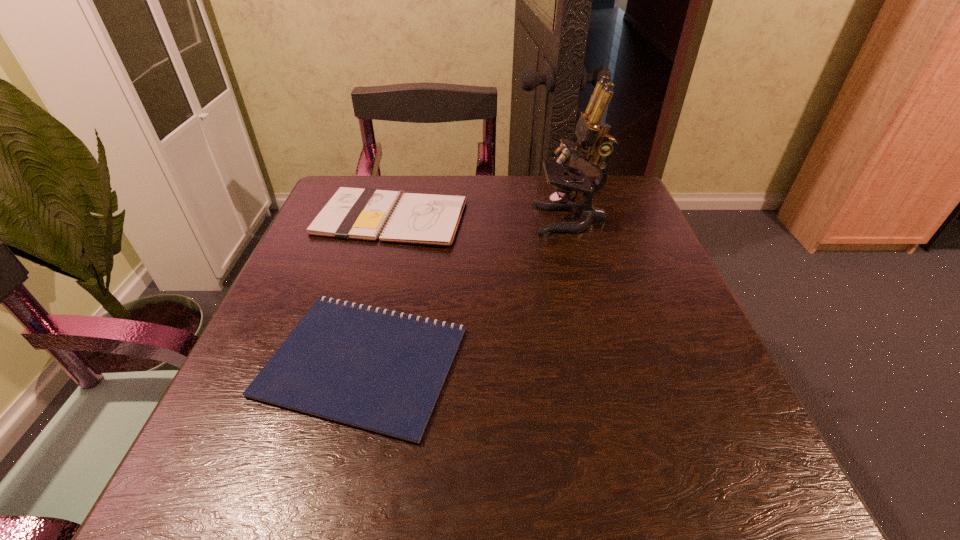
Identify the location of free space at the left edge of the desktop. The width and height of the screenshot is (960, 540). (295, 291).

Image resolution: width=960 pixels, height=540 pixels. Find the location of `free space at the right edge of the desktop`. free space at the right edge of the desktop is located at coordinates (618, 313).

At what (x,y) coordinates should I click in order to perform the action: click on free region at the near left corner. Please return your answer as a coordinate pair (x, y). Looking at the image, I should click on (303, 465).

In order to click on empty space between the nearer notepad and the second shortest object in this screenshot , I will do `click(377, 289)`.

I want to click on vacant space in between the rightmost object and the shortest object, so click(467, 291).

The image size is (960, 540). I want to click on vacant space in between the nearer notepad and the taller notepad, so click(377, 289).

Image resolution: width=960 pixels, height=540 pixels. In order to click on empty location between the nearest object and the microscope in this screenshot , I will do `click(467, 291)`.

Locate an element on the screen. free space between the tallest object and the farther notepad is located at coordinates (481, 219).

The image size is (960, 540). Find the location of `free space between the microscope and the shorter notepad`. free space between the microscope and the shorter notepad is located at coordinates (467, 291).

You are a GUI agent. You are given a task and a screenshot of the screen. Output one action in this format:
    pyautogui.click(x=<x>, y=<y>)
    Task: Click on the unoccupied position between the tallest object and the farther notepad
    Image resolution: width=960 pixels, height=540 pixels.
    Given the screenshot: What is the action you would take?
    pyautogui.click(x=481, y=219)